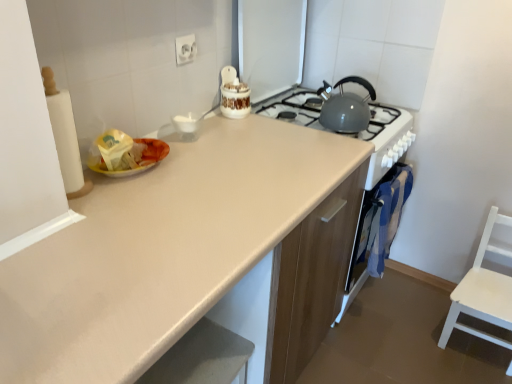
I want to click on empty space that is ontop of matte beige countertop at center (from a real-world perspective), so click(198, 202).